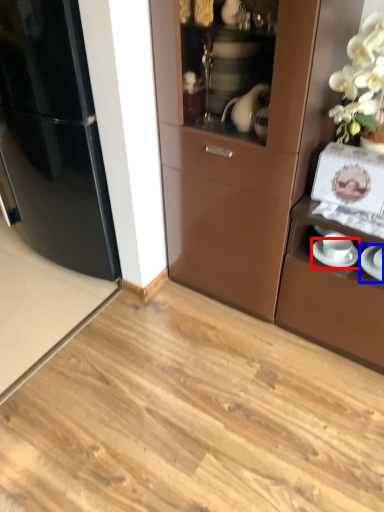
Question: Which object is closer to the camera taking this photo, saucer (highlighted by a red box) or saucer (highlighted by a blue box)?

Choices:
 (A) saucer
 (B) saucer

Answer: (B)